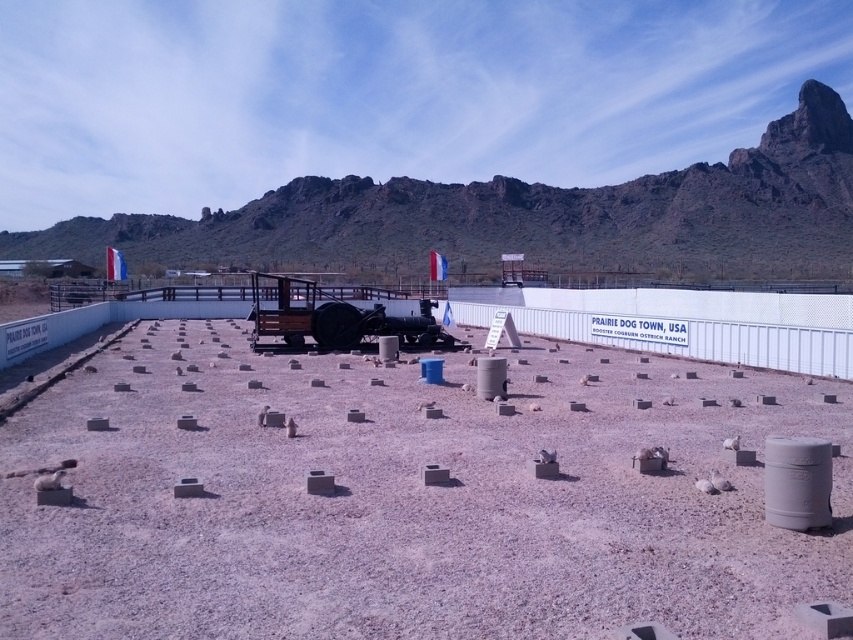
Measure the distance from rugged rock formation at upper center to rustic wood wagon at center.

The distance of rugged rock formation at upper center from rustic wood wagon at center is 79.47 meters.

Which is above, rugged rock formation at upper center or rustic wood wagon at center?

rugged rock formation at upper center

Does point (367, 214) come behind point (399, 340)?

Yes, point (367, 214) is farther from viewer.

Find the location of `rugged rock formation at upper center`. rugged rock formation at upper center is located at coordinates (526, 216).

You are a GUI agent. You are given a task and a screenshot of the screen. Output one action in this format:
    pyautogui.click(x=<x>, y=<y>)
    Task: Click on the brown gravel dirt at center
    The width and height of the screenshot is (853, 640).
    Given the screenshot: What is the action you would take?
    pyautogui.click(x=407, y=502)

Can you confirm if brown gravel dirt at center is positioned to the left of rustic wood wagon at center?

In fact, brown gravel dirt at center is to the right of rustic wood wagon at center.

Which is in front, point (838, 540) or point (300, 323)?

Positioned in front is point (838, 540).

Locate an element on the screen. This screenshot has width=853, height=640. brown gravel dirt at center is located at coordinates (407, 502).

Can you confirm if brown gravel dirt at center is positioned below rugged rock formation at upper center?

Yes, brown gravel dirt at center is below rugged rock formation at upper center.

Where is `brown gravel dirt at center`? brown gravel dirt at center is located at coordinates (407, 502).